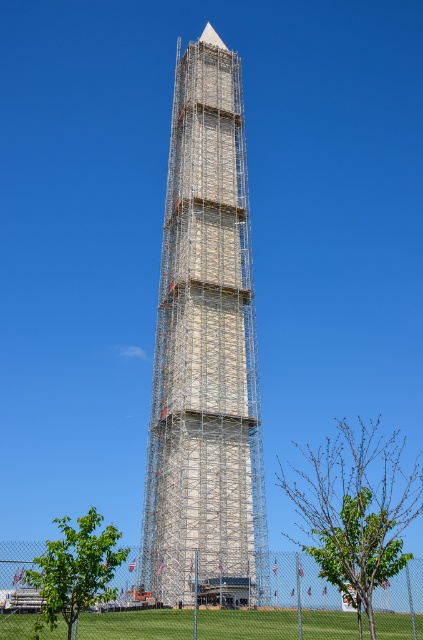
Between silver metallic scaffolding at center and green leafy tree at lower left, which one is positioned higher?

silver metallic scaffolding at center is higher up.

Who is more forward, [247,524] or [73,557]?

Point [73,557]

Is point (216, 243) behind point (110, 541)?

Yes, it is.

I want to click on silver metallic scaffolding at center, so click(x=206, y=355).

From the picture: Is silver metallic scaffolding at center wider than green leafy tree at lower right?

In fact, silver metallic scaffolding at center might be narrower than green leafy tree at lower right.

What do you see at coordinates (206, 355) in the screenshot?
I see `silver metallic scaffolding at center` at bounding box center [206, 355].

I want to click on silver metallic scaffolding at center, so click(x=206, y=355).

Which is above, green leafy tree at lower right or green leafy tree at lower left?

Positioned higher is green leafy tree at lower right.

What do you see at coordinates (357, 508) in the screenshot?
I see `green leafy tree at lower right` at bounding box center [357, 508].

The width and height of the screenshot is (423, 640). Identify the location of green leafy tree at lower right. (x=357, y=508).